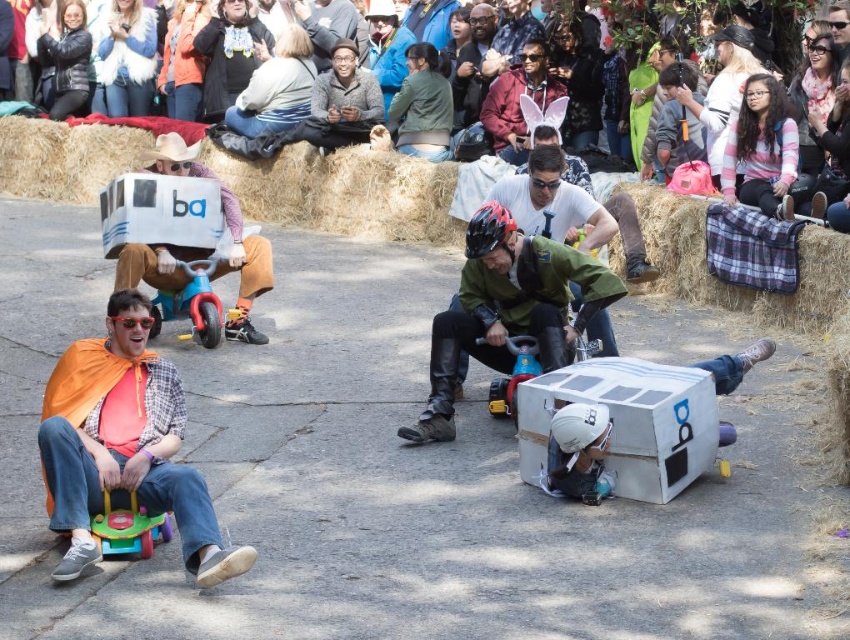
You are a photographer trying to capture the race participants. You notice the orange fabric cape at left and the matte plastic toy car at center. Which object should you focus on first if you want to photograph the one closer to the front?

The orange fabric cape at left is in front of the matte plastic toy car at center, so you should focus on the orange fabric cape at left first to capture the closer object.

Consider the image. You are a photographer at the event and want to capture a photo of both the multicolored fabric at upper center and the matte plastic tricycle at center without any obstructions. Based on their heights, which object should you position closer to the camera to ensure both are fully visible?

The multicolored fabric at upper center is taller than the matte plastic tricycle at center. To ensure both are fully visible without obstructions, position the multicolored fabric at upper center closer to the camera so its height doesn